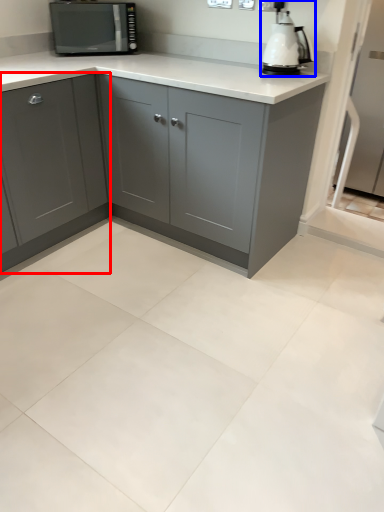
Question: Among these objects, which one is nearest to the camera, cabinetry (highlighted by a red box) or home appliance (highlighted by a blue box)?

Choices:
 (A) cabinetry
 (B) home appliance

Answer: (A)